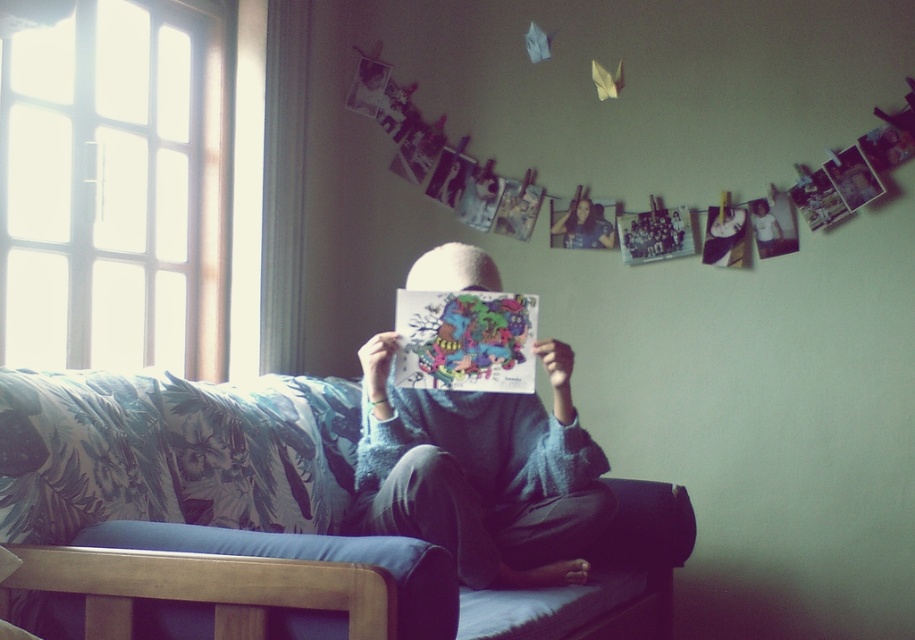
Question: Considering the real-world distances, which object is closest to the smooth skin face at center?

Choices:
 (A) blue fabric couch at center
 (B) blue knitted sweater at center

Answer: (B)

Question: From the image, what is the correct spatial relationship of blue fabric couch at center in relation to blue knitted sweater at center?

Choices:
 (A) left
 (B) right

Answer: (A)

Question: Observing the image, what is the correct spatial positioning of blue knitted sweater at center in reference to smooth skin face at center?

Choices:
 (A) right
 (B) left

Answer: (B)

Question: Which point appears closest to the camera in this image?

Choices:
 (A) (584, 506)
 (B) (214, 547)

Answer: (B)

Question: Based on their relative distances, which object is farther from the smooth skin face at center?

Choices:
 (A) blue fabric couch at center
 (B) blue knitted sweater at center

Answer: (A)

Question: Is blue fabric couch at center bigger than blue knitted sweater at center?

Choices:
 (A) no
 (B) yes

Answer: (B)